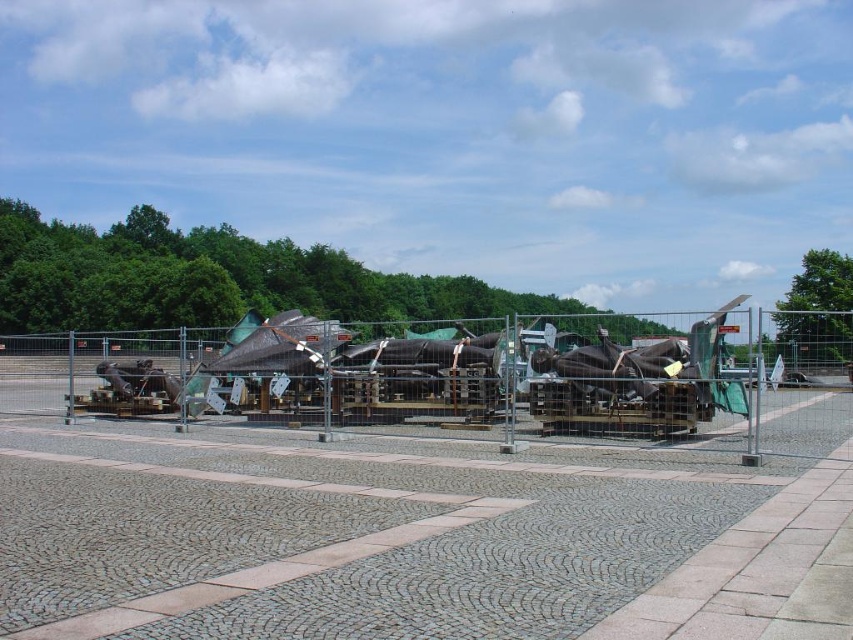
Question: Does cobblestone pavement at center appear on the right side of metal wire fence at center?

Choices:
 (A) yes
 (B) no

Answer: (A)

Question: Which point is closer to the camera taking this photo?

Choices:
 (A) (428, 326)
 (B) (35, 570)

Answer: (B)

Question: Among these points, which one is farthest from the camera?

Choices:
 (A) (350, 404)
 (B) (764, 480)

Answer: (A)

Question: From the image, what is the correct spatial relationship of cobblestone pavement at center in relation to metal wire fence at center?

Choices:
 (A) below
 (B) above

Answer: (A)

Question: Can you confirm if cobblestone pavement at center is positioned to the right of metal wire fence at center?

Choices:
 (A) no
 (B) yes

Answer: (B)